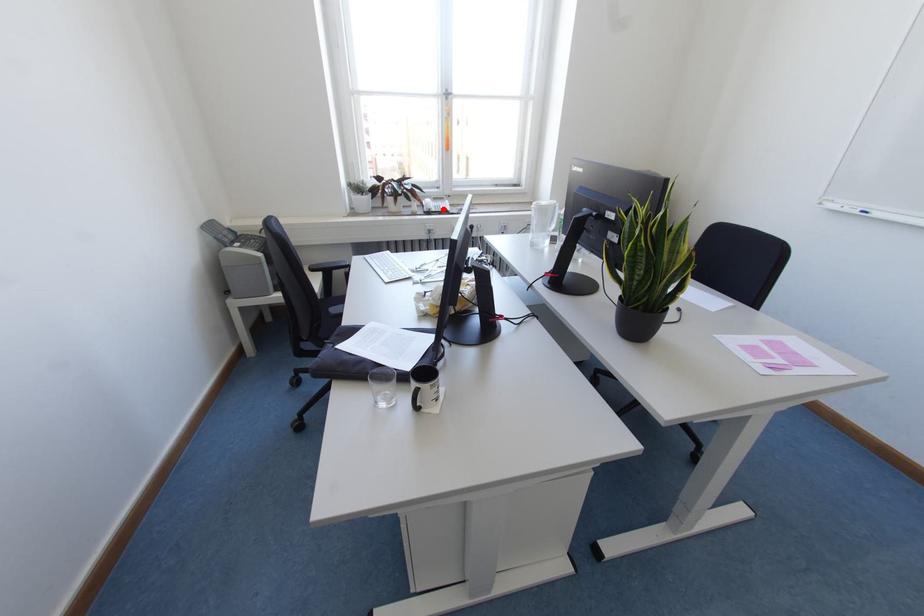
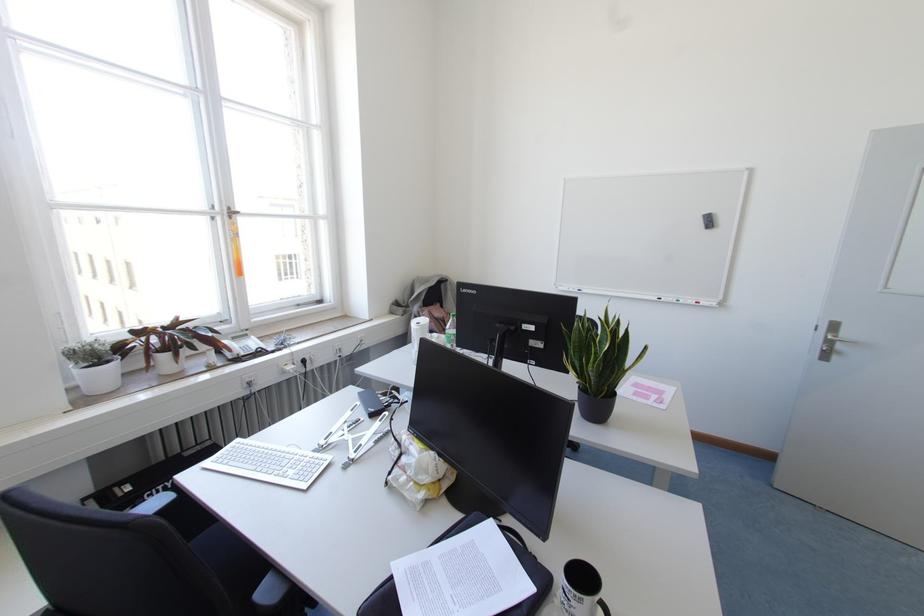
Question: I am providing you with two images of the same scene from different viewpoints. A red point is marked on the first image. At the location where the point appears in image 1, is it still visible in image 2?

Choices:
 (A) Yes
 (B) No

Answer: (A)